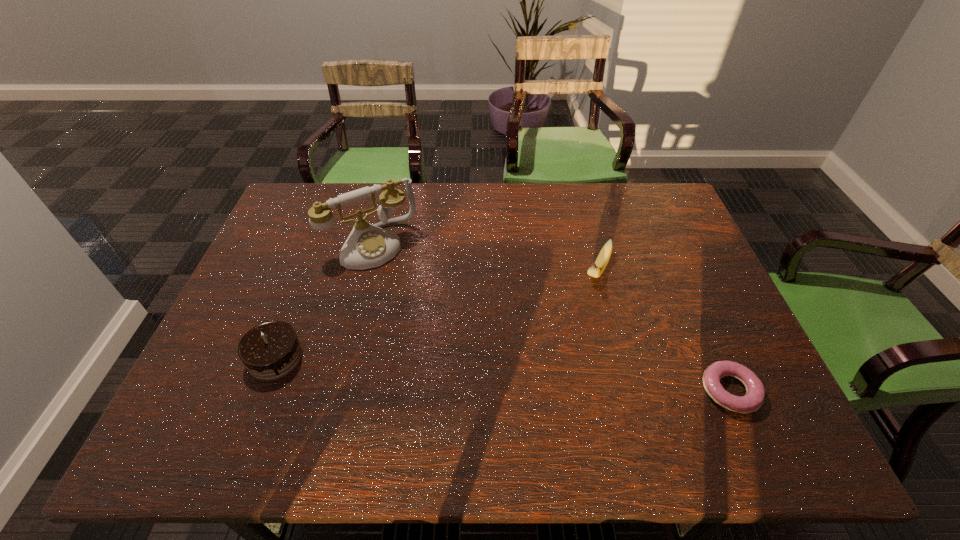
In the image, there is a desktop. Identify the location of vacant space at the far edge. (528, 197).

In the image, there is a desktop. Identify the location of free space at the near edge. The image size is (960, 540). (298, 385).

Locate an element on the screen. This screenshot has width=960, height=540. vacant region at the left edge is located at coordinates (271, 274).

In the image, there is a desktop. Identify the location of vacant space at the right edge. The width and height of the screenshot is (960, 540). pyautogui.click(x=711, y=338).

You are a GUI agent. You are given a task and a screenshot of the screen. Output one action in this format:
    pyautogui.click(x=<x>, y=<y>)
    Task: Click on the free location at the far left corner
    
    Given the screenshot: What is the action you would take?
    pyautogui.click(x=331, y=184)

The image size is (960, 540). Find the location of `vacant space at the far right corner`. vacant space at the far right corner is located at coordinates (647, 219).

The width and height of the screenshot is (960, 540). Identify the location of vacant position at the near right corner of the desktop. (735, 384).

The width and height of the screenshot is (960, 540). Identify the location of empty location between the doughnut and the chocolate cake. (502, 374).

The image size is (960, 540). I want to click on empty space that is in between the tallest object and the chocolate cake, so click(324, 301).

Find the location of `vacant region between the chocolate cake and the shortest object`. vacant region between the chocolate cake and the shortest object is located at coordinates (502, 374).